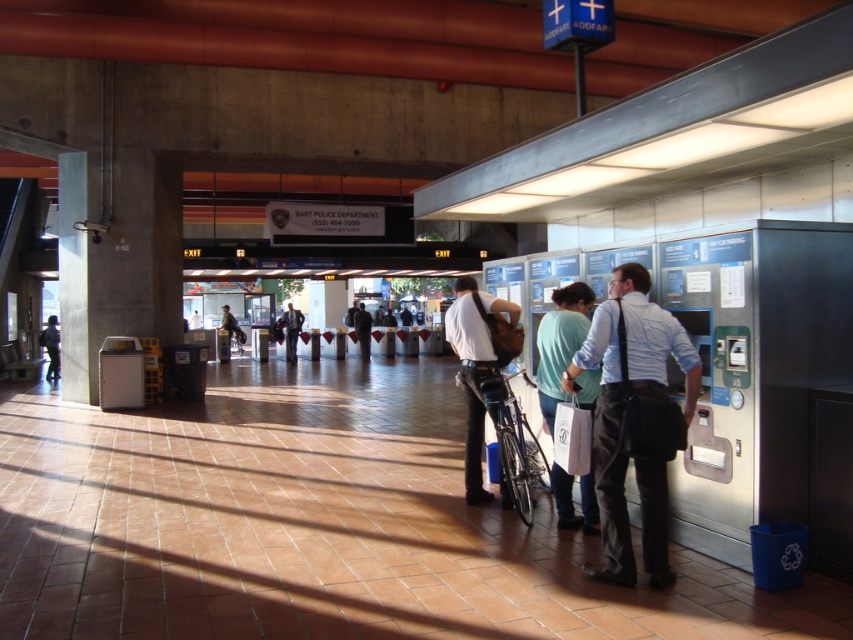
From the picture: Between light green fabric shirt at center and dark blue shirt at center, which one has less height?

With less height is light green fabric shirt at center.

Does point (537, 372) come closer to viewer compared to point (234, 317)?

Yes, point (537, 372) is in front of point (234, 317).

You are a GUI agent. You are given a task and a screenshot of the screen. Output one action in this format:
    pyautogui.click(x=<x>, y=<y>)
    Task: Click on the light green fabric shirt at center
    Image resolution: width=853 pixels, height=640 pixels.
    Given the screenshot: What is the action you would take?
    pyautogui.click(x=560, y=342)

Is point (366, 333) more distant than point (238, 346)?

No, it is not.

Between point (360, 312) and point (223, 316), which one is positioned behind?

Point (360, 312)

The width and height of the screenshot is (853, 640). What are the coordinates of `dark gray uniform at center` in the screenshot? It's located at click(x=363, y=330).

Is light blue shirt at center smaller than light green fabric shirt at center?

No, light blue shirt at center is not smaller than light green fabric shirt at center.

Is the position of light blue shirt at center more distant than that of light green fabric shirt at center?

No, light blue shirt at center is closer to the viewer.

Is point (646, 557) closer to camera compared to point (561, 339)?

Yes, point (646, 557) is in front of point (561, 339).

Identify the location of light blue shirt at center. (611, 486).